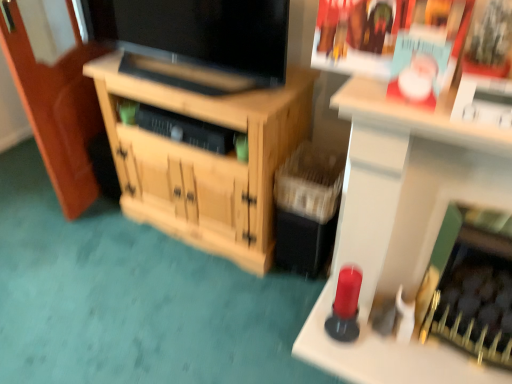
Question: Is matte paper magazine at upper right at the right side of wooden cabinet at center?

Choices:
 (A) yes
 (B) no

Answer: (A)

Question: Is wooden cabinet at center completely or partially inside matte paper magazine at upper right?

Choices:
 (A) no
 (B) yes

Answer: (A)

Question: Is matte paper magazine at upper right in contact with wooden cabinet at center?

Choices:
 (A) no
 (B) yes

Answer: (A)

Question: From a real-world perspective, is matte paper magazine at upper right positioned over wooden cabinet at center based on gravity?

Choices:
 (A) yes
 (B) no

Answer: (A)

Question: Is matte paper magazine at upper right not close to wooden cabinet at center?

Choices:
 (A) yes
 (B) no

Answer: (B)

Question: From the image's perspective, is matte paper magazine at upper right positioned above or below wooden cabinet at center?

Choices:
 (A) above
 (B) below

Answer: (A)

Question: Is matte paper magazine at upper right bigger or smaller than wooden cabinet at center?

Choices:
 (A) big
 (B) small

Answer: (B)

Question: Considering their positions, is matte paper magazine at upper right located in front of or behind wooden cabinet at center?

Choices:
 (A) behind
 (B) front

Answer: (B)

Question: Is point (392, 84) positioned closer to the camera than point (180, 178)?

Choices:
 (A) closer
 (B) farther

Answer: (A)

Question: In the image, is wooden cabinet at center on the left side or the right side of matte paper magazine at upper right?

Choices:
 (A) right
 (B) left

Answer: (B)

Question: Choose the correct answer: Is wooden cabinet at center inside matte paper magazine at upper right or outside it?

Choices:
 (A) outside
 (B) inside

Answer: (A)

Question: From the image's perspective, is wooden cabinet at center located above or below matte paper magazine at upper right?

Choices:
 (A) above
 (B) below

Answer: (B)

Question: Considering the positions of wooden cabinet at center and matte paper magazine at upper right in the image, is wooden cabinet at center taller or shorter than matte paper magazine at upper right?

Choices:
 (A) tall
 (B) short

Answer: (A)

Question: From their relative heights in the image, would you say matte black tv at center is taller or shorter than wooden cabinet at center?

Choices:
 (A) short
 (B) tall

Answer: (A)

Question: Considering the positions of matte black tv at center and wooden cabinet at center in the image, is matte black tv at center wider or thinner than wooden cabinet at center?

Choices:
 (A) wide
 (B) thin

Answer: (B)